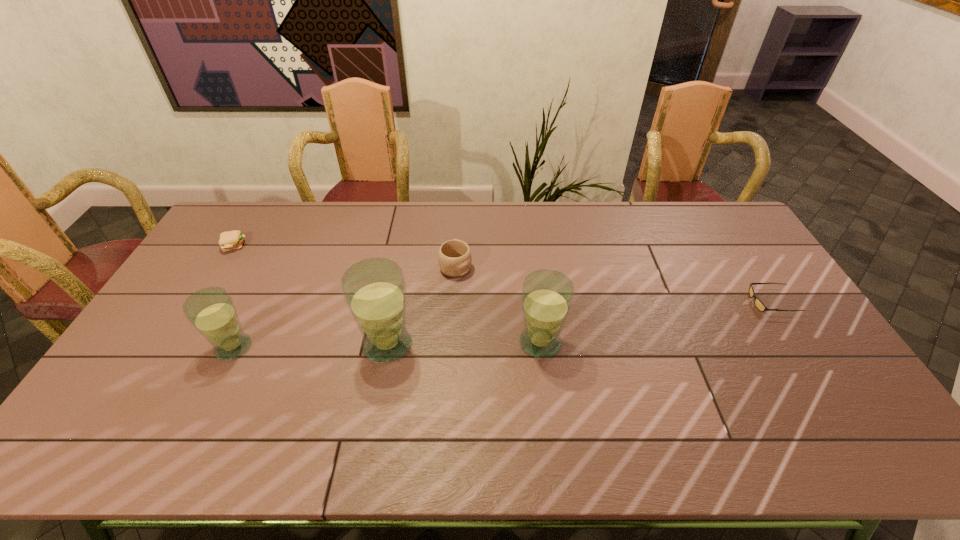
What are the coordinates of `vacant space located on the side of the mug with the handle` in the screenshot? It's located at (458, 225).

Where is `object that is at the far edge`? object that is at the far edge is located at coordinates (232, 240).

I want to click on object at the left edge, so click(x=232, y=240).

Where is `object located at the right edge`? The height and width of the screenshot is (540, 960). object located at the right edge is located at coordinates (758, 303).

What are the coordinates of `object that is positioned at the far left corner` in the screenshot? It's located at (232, 240).

Find the location of `vacant area at the far edge of the desktop`. vacant area at the far edge of the desktop is located at coordinates (261, 235).

Identify the location of vacant space at the near edge of the desktop. (711, 392).

Find the location of a particular element. This screenshot has width=960, height=540. vacant space at the left edge is located at coordinates (188, 288).

The height and width of the screenshot is (540, 960). Identify the location of free space at the right edge. (793, 315).

Locate an element on the screen. free spot between the leftmost glass and the third object from left to right is located at coordinates (311, 346).